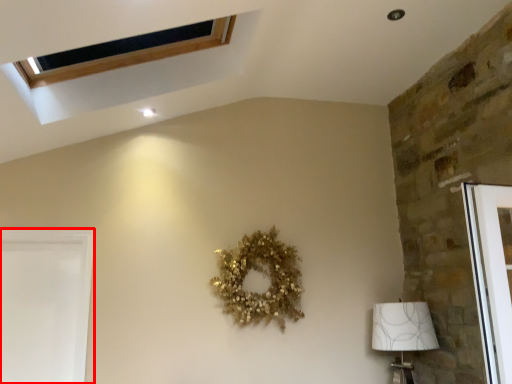
Question: In this image, where is screen door (annotated by the red box) located relative to lamp?

Choices:
 (A) right
 (B) left

Answer: (B)